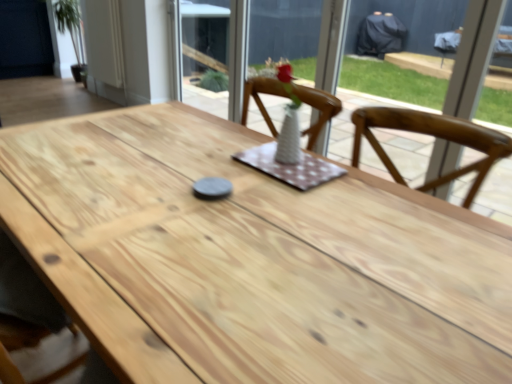
Question: Is white ceramic vase at center smaller than natural wood table at center?

Choices:
 (A) yes
 (B) no

Answer: (A)

Question: Is white ceramic vase at center shorter than natural wood table at center?

Choices:
 (A) yes
 (B) no

Answer: (A)

Question: Is the position of white ceramic vase at center less distant than that of natural wood table at center?

Choices:
 (A) yes
 (B) no

Answer: (B)

Question: From a real-world perspective, does white ceramic vase at center sit lower than natural wood table at center?

Choices:
 (A) yes
 (B) no

Answer: (B)

Question: Can you confirm if white ceramic vase at center is taller than natural wood table at center?

Choices:
 (A) yes
 (B) no

Answer: (B)

Question: Does point (102, 46) appear closer or farther from the camera than point (103, 352)?

Choices:
 (A) closer
 (B) farther

Answer: (B)

Question: Considering their positions, is white wood door at upper left located in front of or behind natural wood table at center?

Choices:
 (A) behind
 (B) front

Answer: (A)

Question: From the image's perspective, relative to natural wood table at center, is white wood door at upper left above or below?

Choices:
 (A) below
 (B) above

Answer: (B)

Question: Choose the correct answer: Is white wood door at upper left inside natural wood table at center or outside it?

Choices:
 (A) outside
 (B) inside

Answer: (A)

Question: In the image, is white ceramic vase at center positioned in front of or behind white glass vase at upper center?

Choices:
 (A) behind
 (B) front

Answer: (B)

Question: In terms of height, does white ceramic vase at center look taller or shorter compared to white glass vase at upper center?

Choices:
 (A) short
 (B) tall

Answer: (A)

Question: Is white ceramic vase at center bigger or smaller than white glass vase at upper center?

Choices:
 (A) small
 (B) big

Answer: (A)

Question: From a real-world perspective, relative to white glass vase at upper center, is white ceramic vase at center vertically above or below?

Choices:
 (A) above
 (B) below

Answer: (A)

Question: Considering the relative positions of white wood door at upper left and white ceramic vase at center in the image provided, is white wood door at upper left to the left or to the right of white ceramic vase at center?

Choices:
 (A) right
 (B) left

Answer: (B)

Question: From their relative heights in the image, would you say white wood door at upper left is taller or shorter than white ceramic vase at center?

Choices:
 (A) tall
 (B) short

Answer: (A)